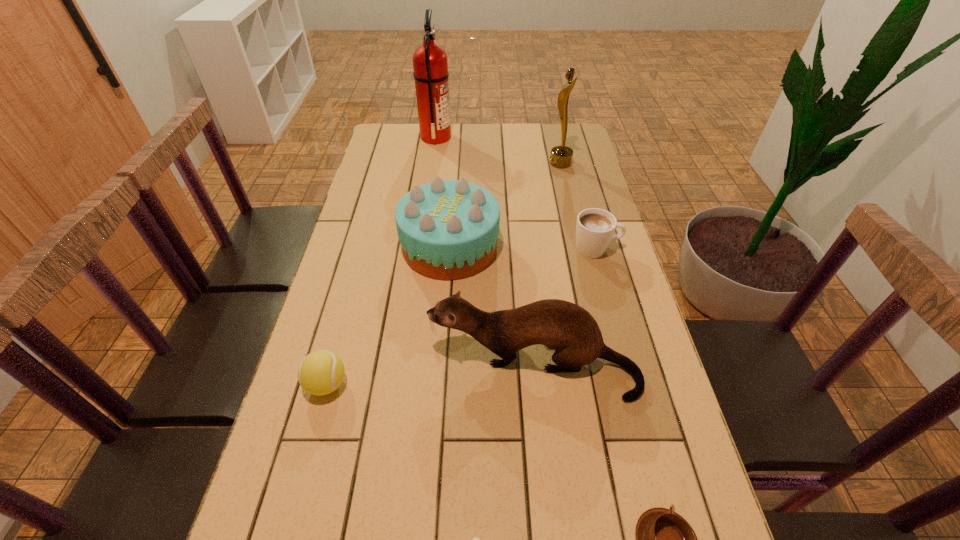
Where is `the tallest object`? The image size is (960, 540). the tallest object is located at coordinates (430, 65).

At what (x,y) coordinates should I click in order to perform the action: click on the farthest object. Please return your answer as a coordinate pair (x, y). Image resolution: width=960 pixels, height=540 pixels. Looking at the image, I should click on (430, 65).

Where is `award`? award is located at coordinates (561, 156).

I want to click on the seventh shortest object, so click(x=561, y=156).

What are the coordinates of `cake` in the screenshot? It's located at (448, 229).

The image size is (960, 540). I want to click on brown ferret, so click(571, 330).

The width and height of the screenshot is (960, 540). Identify the location of the farther white cappuccino. (595, 227).

Identify the location of the bigger white cappuccino. The image size is (960, 540). (595, 227).

The width and height of the screenshot is (960, 540). Find the location of `the leftmost object`. the leftmost object is located at coordinates (321, 372).

I want to click on tennis ball, so click(x=321, y=372).